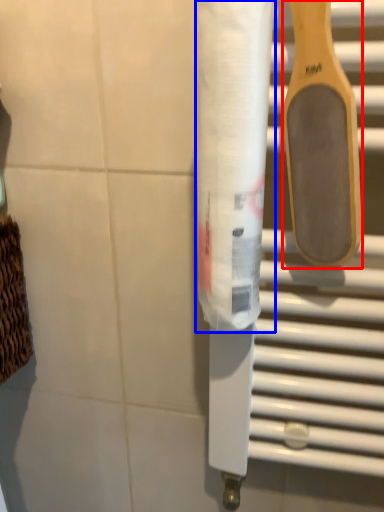
Question: Which point is further to the camera, spatula (highlighted by a red box) or toilet paper (highlighted by a blue box)?

Choices:
 (A) spatula
 (B) toilet paper

Answer: (B)